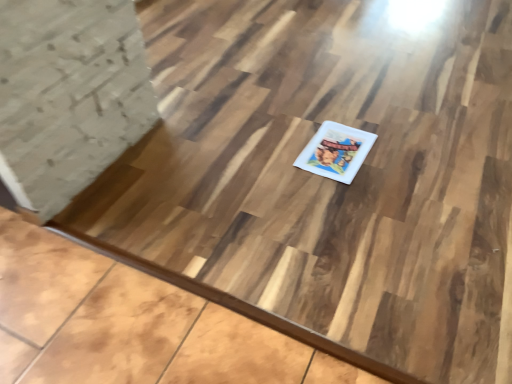
This screenshot has width=512, height=384. What do you see at coordinates (336, 151) in the screenshot? I see `white glossy book at center` at bounding box center [336, 151].

The width and height of the screenshot is (512, 384). Find the location of `white glossy book at center`. white glossy book at center is located at coordinates (336, 151).

What is the approximate height of white glossy book at center?

The height of white glossy book at center is 1.03 centimeters.

Image resolution: width=512 pixels, height=384 pixels. I want to click on white glossy book at center, so click(336, 151).